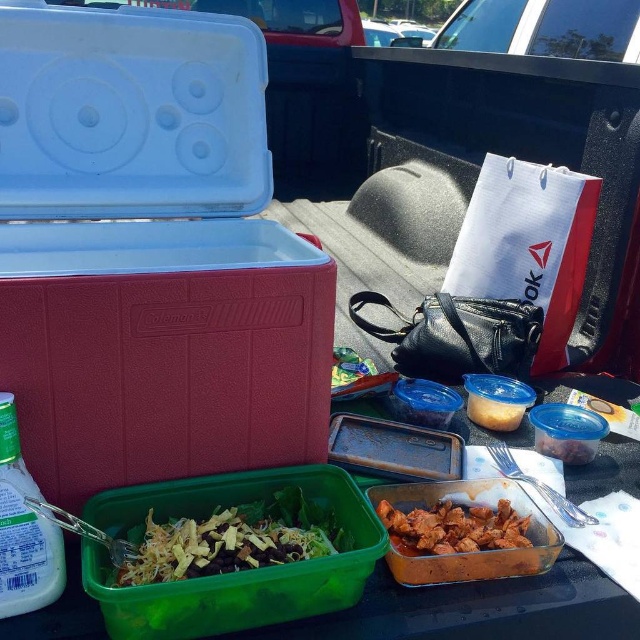
You are organizing a picnic and have a green plastic salad bowl at center and shiny brown meat at center in the truck bed. You need to place a 10 inch long utensil between them. Is there enough space?

The green plastic salad bowl at center and shiny brown meat at center are 7.08 inches apart from each other. Since the utensil is 10 inches long, which is longer than the space between them, there is not enough space to place the utensil between them.

You are organizing a picnic in the truck bed and need to place a new item at the coordinates point (230, 540). What object is currently located at this position?

The point (230, 540) corresponds to the green plastic salad bowl at center.

You are organizing a picnic and need to stack the translucent plastic lunch box at lower left and the shiny brown meat at center. Can you place the taller item on top of the shorter one?

The translucent plastic lunch box at lower left is much taller than the shiny brown meat at center, so you can place the taller translucent plastic lunch box at lower left on top of the shorter one.